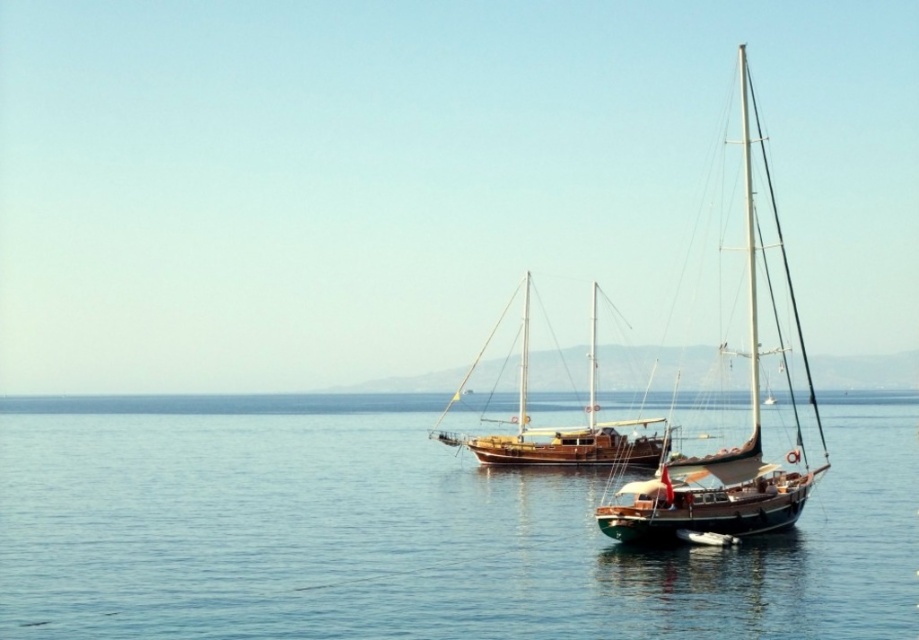
Question: Which of the following is the closest to the observer?

Choices:
 (A) brown wooden sailboat at center
 (B) wooden sailboat at right
 (C) blue water at center

Answer: (C)

Question: Which of the following is the farthest from the observer?

Choices:
 (A) brown wooden sailboat at center
 (B) wooden sailboat at right

Answer: (A)

Question: Can you confirm if blue water at center is thinner than wooden sailboat at right?

Choices:
 (A) yes
 (B) no

Answer: (B)

Question: Which of these objects is positioned closest to the blue water at center?

Choices:
 (A) wooden sailboat at right
 (B) brown wooden sailboat at center

Answer: (B)

Question: Is blue water at center further to camera compared to wooden sailboat at right?

Choices:
 (A) no
 (B) yes

Answer: (A)

Question: Can you confirm if wooden sailboat at right is smaller than brown wooden sailboat at center?

Choices:
 (A) no
 (B) yes

Answer: (A)